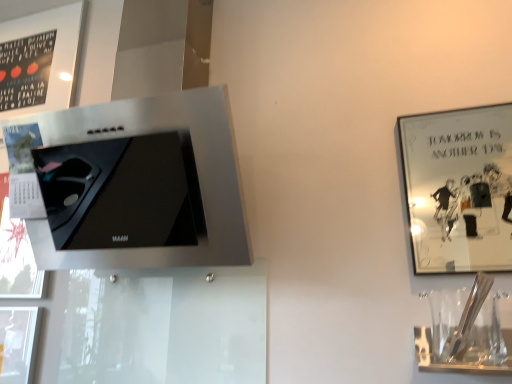
Question: Is the position of matte black frame at upper left, which ranks as the first picture frame in top-to-bottom order, more distant than that of metallic silver picture frame at upper right, which is the second picture frame in left-to-right order?

Choices:
 (A) yes
 (B) no

Answer: (A)

Question: Is matte black frame at upper left, which ranks as the first picture frame in top-to-bottom order, shorter than metallic silver picture frame at upper right, marked as the 2th picture frame in a top-to-bottom arrangement?

Choices:
 (A) no
 (B) yes

Answer: (A)

Question: Does matte black frame at upper left, which ranks as the first picture frame in top-to-bottom order, have a larger size compared to metallic silver picture frame at upper right, the 2th picture frame positioned from the back?

Choices:
 (A) no
 (B) yes

Answer: (B)

Question: Is there a large distance between matte black frame at upper left, arranged as the 2th picture frame when viewed from the right, and metallic silver picture frame at upper right, marked as the 2th picture frame in a top-to-bottom arrangement?

Choices:
 (A) no
 (B) yes

Answer: (B)

Question: Is matte black frame at upper left, which ranks as the first picture frame in top-to-bottom order, in front of metallic silver picture frame at upper right, marked as the 2th picture frame in a top-to-bottom arrangement?

Choices:
 (A) no
 (B) yes

Answer: (A)

Question: Does matte black frame at upper left, positioned as the second picture frame in bottom-to-top order, appear on the left side of metallic silver picture frame at upper right, the 2th picture frame positioned from the back?

Choices:
 (A) no
 (B) yes

Answer: (B)

Question: Is satin silver range hood at upper left oriented away from clear glass wine glass at lower right?

Choices:
 (A) no
 (B) yes

Answer: (A)

Question: From the image's perspective, is satin silver range hood at upper left on clear glass wine glass at lower right?

Choices:
 (A) yes
 (B) no

Answer: (A)

Question: Is satin silver range hood at upper left to the right of clear glass wine glass at lower right from the viewer's perspective?

Choices:
 (A) yes
 (B) no

Answer: (B)

Question: Would you say satin silver range hood at upper left contains clear glass wine glass at lower right?

Choices:
 (A) yes
 (B) no

Answer: (B)

Question: Is satin silver range hood at upper left facing towards clear glass wine glass at lower right?

Choices:
 (A) yes
 (B) no

Answer: (B)

Question: Is satin silver range hood at upper left not within clear glass wine glass at lower right?

Choices:
 (A) no
 (B) yes

Answer: (B)

Question: Is matte black frame at upper left, positioned as the second picture frame in bottom-to-top order, completely or partially inside metallic silver picture frame at upper right, which is the second picture frame in left-to-right order?

Choices:
 (A) no
 (B) yes

Answer: (A)